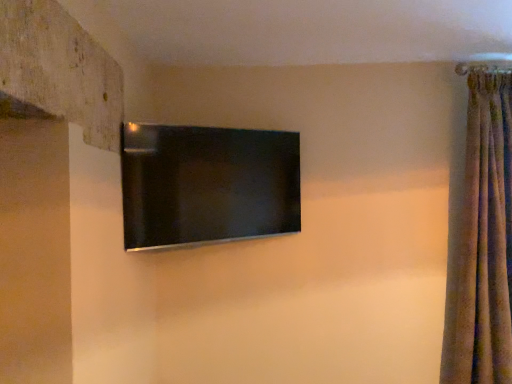
What is the approximate height of brown velvet curtain at right?

brown velvet curtain at right is 1.57 meters in height.

In order to click on brown velvet curtain at right in this screenshot , I will do `click(483, 242)`.

This screenshot has width=512, height=384. Describe the element at coordinates (483, 242) in the screenshot. I see `brown velvet curtain at right` at that location.

At what (x,y) coordinates should I click in order to perform the action: click on matte black tv at center. Please return your answer as a coordinate pair (x, y). Looking at the image, I should click on (207, 184).

The width and height of the screenshot is (512, 384). Describe the element at coordinates (207, 184) in the screenshot. I see `matte black tv at center` at that location.

Find the location of a particular element. This screenshot has height=384, width=512. brown velvet curtain at right is located at coordinates (483, 242).

Is matte black tv at center to the right of brown velvet curtain at right from the viewer's perspective?

No, matte black tv at center is not to the right of brown velvet curtain at right.

Considering the positions of objects matte black tv at center and brown velvet curtain at right in the image provided, who is in front, matte black tv at center or brown velvet curtain at right?

matte black tv at center.

Which is in front, point (188, 205) or point (496, 104)?

The point (188, 205) is in front.

From the image's perspective, which is above, matte black tv at center or brown velvet curtain at right?

matte black tv at center.

From a real-world perspective, is matte black tv at center above or below brown velvet curtain at right?

Clearly, from a real-world perspective, matte black tv at center is above brown velvet curtain at right.

Between matte black tv at center and brown velvet curtain at right, which one has larger width?

With larger width is brown velvet curtain at right.

Is matte black tv at center shorter than brown velvet curtain at right?

Correct, matte black tv at center is not as tall as brown velvet curtain at right.

Does matte black tv at center have a larger size compared to brown velvet curtain at right?

Incorrect, matte black tv at center is not larger than brown velvet curtain at right.

Is brown velvet curtain at right completely or partially inside matte black tv at center?

Definitely not — brown velvet curtain at right is not inside matte black tv at center.

Are matte black tv at center and brown velvet curtain at right located far from each other?

Absolutely, matte black tv at center is distant from brown velvet curtain at right.

Is matte black tv at center turned away from brown velvet curtain at right?

No, brown velvet curtain at right is not at the back of matte black tv at center.

What's the angular difference between matte black tv at center and brown velvet curtain at right's facing directions?

matte black tv at center and brown velvet curtain at right are facing 39.7 degrees away from each other.

What are the coordinates of `curtain on the right of matte black tv at center` in the screenshot? It's located at (483, 242).

Visually, is brown velvet curtain at right positioned to the left or to the right of matte black tv at center?

brown velvet curtain at right is to the right of matte black tv at center.

Looking at this image, considering their positions, is brown velvet curtain at right located in front of or behind matte black tv at center?

brown velvet curtain at right is positioned farther from the viewer than matte black tv at center.

Considering the points (461, 203) and (293, 145), which point is in front, point (461, 203) or point (293, 145)?

The point (461, 203) is closer.

From the image's perspective, is brown velvet curtain at right located above or below matte black tv at center?

Based on their image positions, brown velvet curtain at right is located beneath matte black tv at center.

From a real-world perspective, is brown velvet curtain at right on top of matte black tv at center?

No, from a real-world perspective, brown velvet curtain at right is not on top of matte black tv at center.

Is brown velvet curtain at right wider than matte black tv at center?

Correct, the width of brown velvet curtain at right exceeds that of matte black tv at center.

Considering the sizes of objects brown velvet curtain at right and matte black tv at center in the image provided, who is shorter, brown velvet curtain at right or matte black tv at center?

Standing shorter between the two is matte black tv at center.

Looking at the image, does brown velvet curtain at right seem bigger or smaller compared to matte black tv at center?

Clearly, brown velvet curtain at right is larger in size than matte black tv at center.

Is brown velvet curtain at right spatially inside matte black tv at center, or outside of it?

brown velvet curtain at right is not inside matte black tv at center, it's outside.

Is brown velvet curtain at right not close to matte black tv at center?

brown velvet curtain at right is far away from matte black tv at center.

Is brown velvet curtain at right facing away from matte black tv at center?

brown velvet curtain at right is not turned away from matte black tv at center.

How many degrees apart are the facing directions of brown velvet curtain at right and matte black tv at center?

The facing directions of brown velvet curtain at right and matte black tv at center are 39.7 degrees apart.

How far apart are brown velvet curtain at right and matte black tv at center?

brown velvet curtain at right and matte black tv at center are 1.17 meters apart.

Find the location of a particular element. The width and height of the screenshot is (512, 384). curtain below the matte black tv at center (from a real-world perspective) is located at coordinates (483, 242).

You are a GUI agent. You are given a task and a screenshot of the screen. Output one action in this format:
    pyautogui.click(x=<x>, y=<y>)
    Task: Click on the curtain on the right of matte black tv at center
    
    Given the screenshot: What is the action you would take?
    pyautogui.click(x=483, y=242)

Locate an element on the screen. The width and height of the screenshot is (512, 384). television on the left side of brown velvet curtain at right is located at coordinates (207, 184).